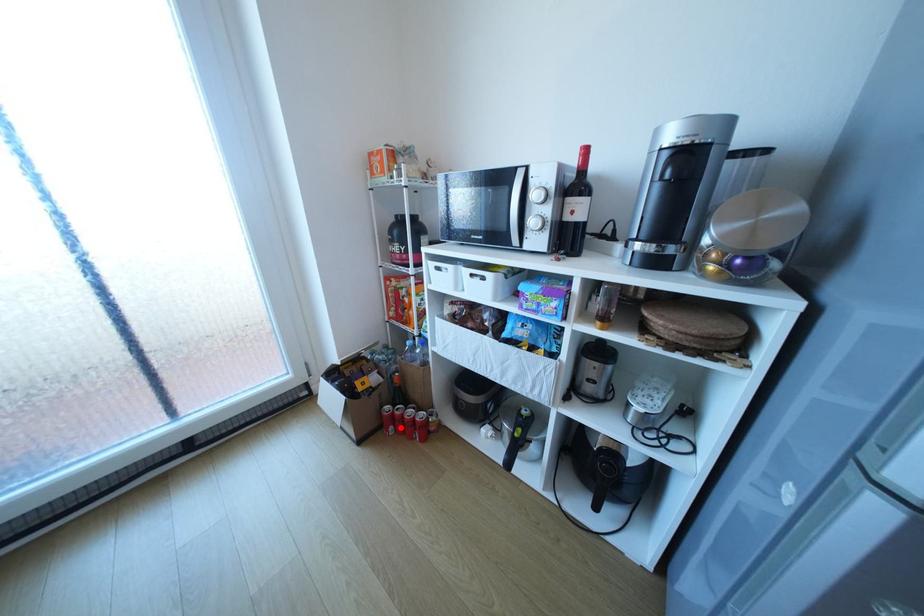
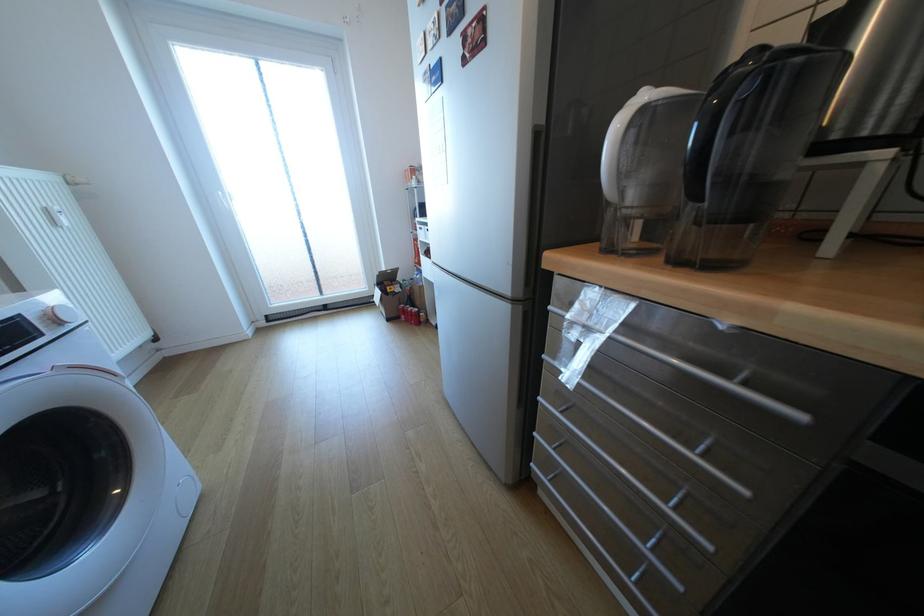
Question: I am providing you with two images of the same scene from different viewpoints. A red point is shown in image1. For the corresponding object point in image2, is it positioned nearer or farther from the camera?

Choices:
 (A) Nearer
 (B) Farther

Answer: (A)